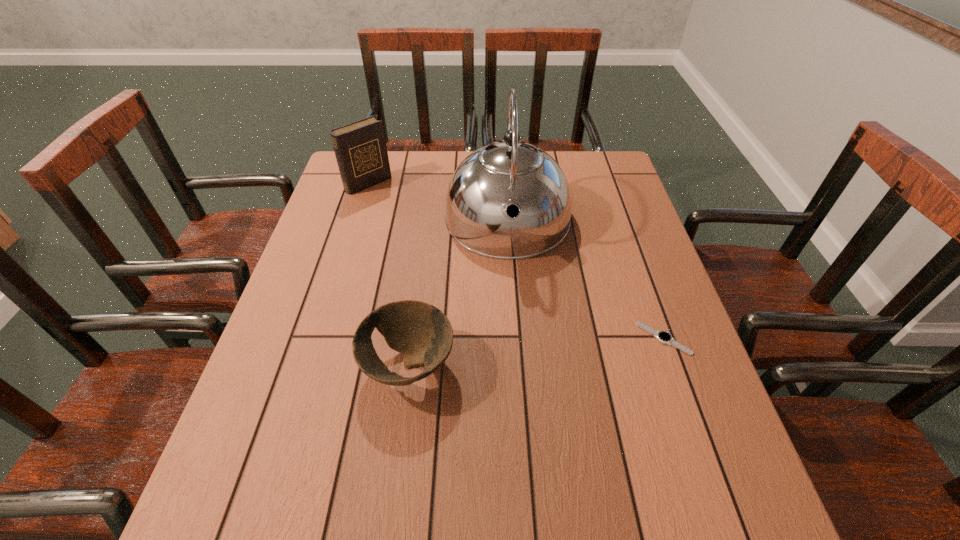
Find the location of a particular element. The height and width of the screenshot is (540, 960). free space on the desktop that is between the bowl and the shortest object and is positioned from the spout of the kettle is located at coordinates (513, 355).

In order to click on vacant spot on the desktop that is between the third tallest object and the rightmost object and is positioned on the front cover of the diary in this screenshot , I will do `click(559, 350)`.